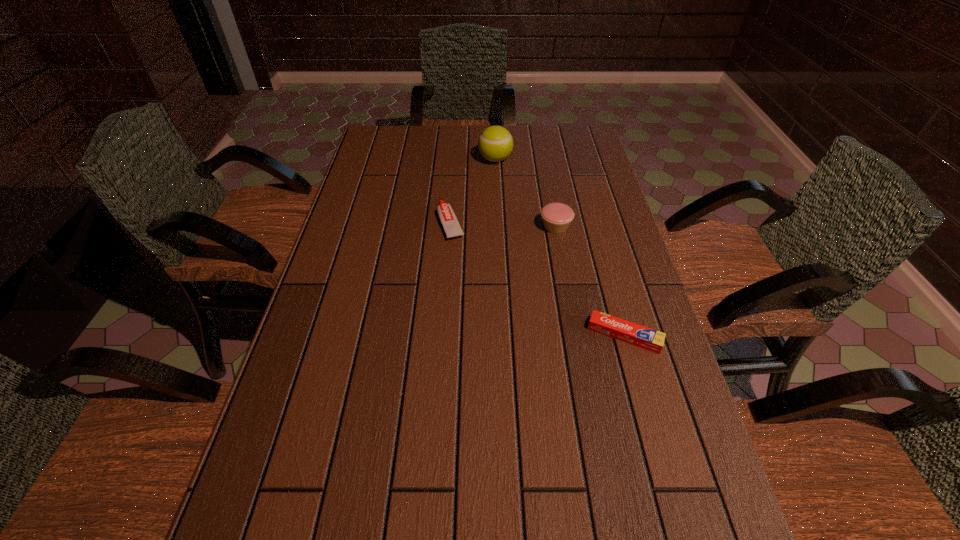
This screenshot has height=540, width=960. In order to click on free space located 0.130m on the left of the nearest object in this screenshot , I will do `click(532, 335)`.

I want to click on object that is at the far edge, so click(495, 144).

Locate an element on the screen. The width and height of the screenshot is (960, 540). cupcake that is at the right edge is located at coordinates point(556,217).

Locate an element on the screen. The width and height of the screenshot is (960, 540). toothpaste that is at the right edge is located at coordinates (631, 333).

You are a GUI agent. You are given a task and a screenshot of the screen. Output one action in this format:
    pyautogui.click(x=<x>, y=<y>)
    Task: Click on the blank space at the far edge
    
    Given the screenshot: What is the action you would take?
    pyautogui.click(x=470, y=137)

Identify the location of vacant space at the left edge of the desktop. (362, 208).

Where is `blank space at the right edge`? This screenshot has width=960, height=540. blank space at the right edge is located at coordinates (607, 376).

The image size is (960, 540). In order to click on vacant space at the far right corner in this screenshot , I will do `click(557, 133)`.

Locate an element on the screen. The image size is (960, 540). free space that is in between the shorter toothpaste and the taller toothpaste is located at coordinates point(538,279).

At what (x,y) coordinates should I click in order to perform the action: click on unoccupied area between the second tallest object and the shortest object. Please return your answer as a coordinate pair (x, y). The height and width of the screenshot is (540, 960). Looking at the image, I should click on (590, 281).